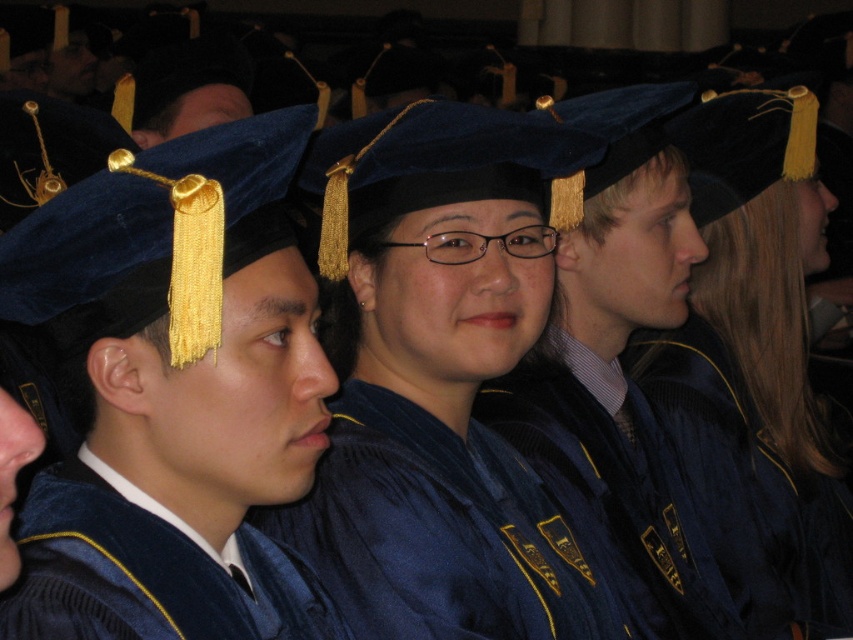
Question: Is satin blue gown at center closer to the viewer compared to velvet blue gown at center?

Choices:
 (A) yes
 (B) no

Answer: (B)

Question: Based on their relative distances, which object is nearer to the blue velvet graduation gown at center?

Choices:
 (A) velvet blue gown at center
 (B) satin blue gown at center
 (C) velvet blue graduation cap at center

Answer: (B)

Question: Estimate the real-world distances between objects in this image. Which object is farther from the velvet blue graduation cap at center?

Choices:
 (A) satin blue gown at center
 (B) blue velvet graduation gown at center

Answer: (B)

Question: Can you confirm if velvet blue graduation cap at center is thinner than blue velvet graduation gown at center?

Choices:
 (A) yes
 (B) no

Answer: (A)

Question: Which of these objects is positioned closest to the velvet blue gown at center?

Choices:
 (A) velvet blue graduation cap at center
 (B) blue velvet graduation gown at center

Answer: (A)

Question: Does velvet blue graduation cap at center have a smaller size compared to velvet blue gown at center?

Choices:
 (A) no
 (B) yes

Answer: (A)